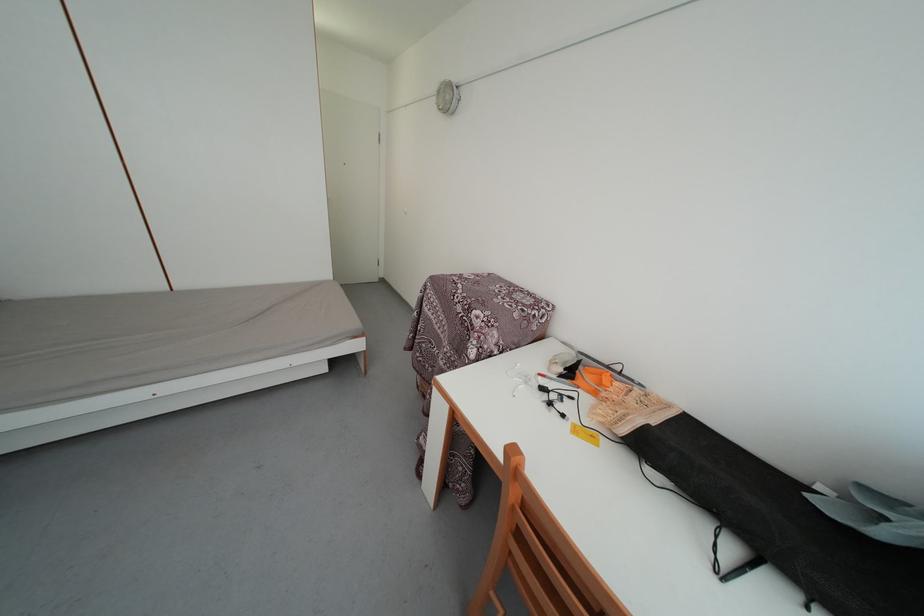
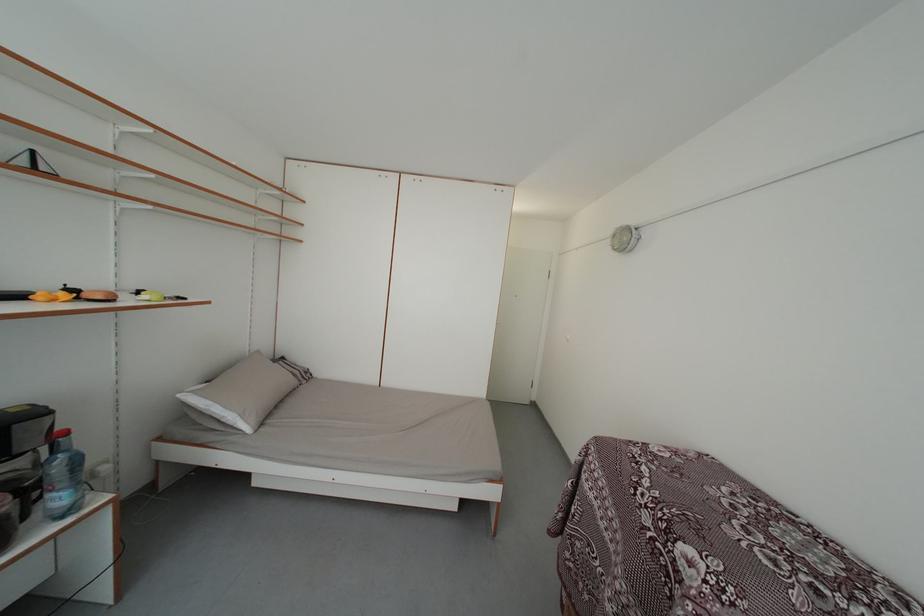
Locate, in the second image, the point that corresponds to [455,105] in the first image.

(631, 246)